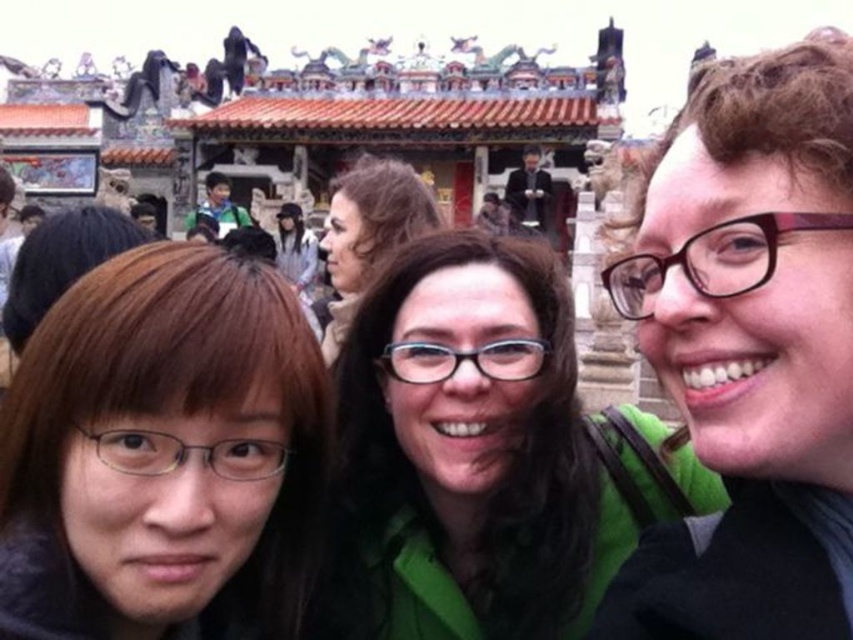
Question: Which point is closer to the camera?

Choices:
 (A) (364, 433)
 (B) (358, 246)
 (C) (248, 218)

Answer: (A)

Question: Which of the following is the closest to the observer?

Choices:
 (A) green fabric shirt at upper left
 (B) brown hair at center
 (C) matte black glasses at center
 (D) dark suit at upper center

Answer: (B)

Question: Which point is farther to the camera?

Choices:
 (A) (345, 284)
 (B) (13, 573)

Answer: (A)

Question: Does brown hair at center appear over green fabric shirt at upper left?

Choices:
 (A) no
 (B) yes

Answer: (A)

Question: Does green matte shirt at center appear on the left side of matte black glasses at center?

Choices:
 (A) no
 (B) yes

Answer: (A)

Question: Can you confirm if brown hair at center is positioned below dark suit at upper center?

Choices:
 (A) yes
 (B) no

Answer: (A)